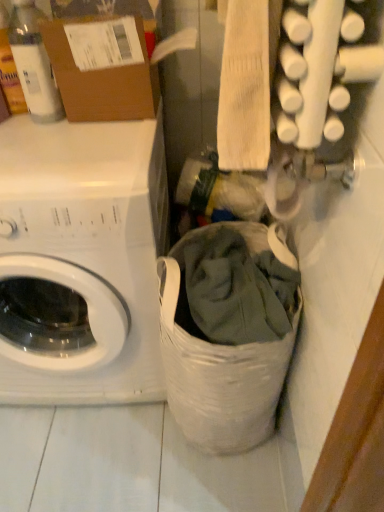
This screenshot has height=512, width=384. I want to click on free space in front of translucent plastic bottle at upper left, so click(x=45, y=142).